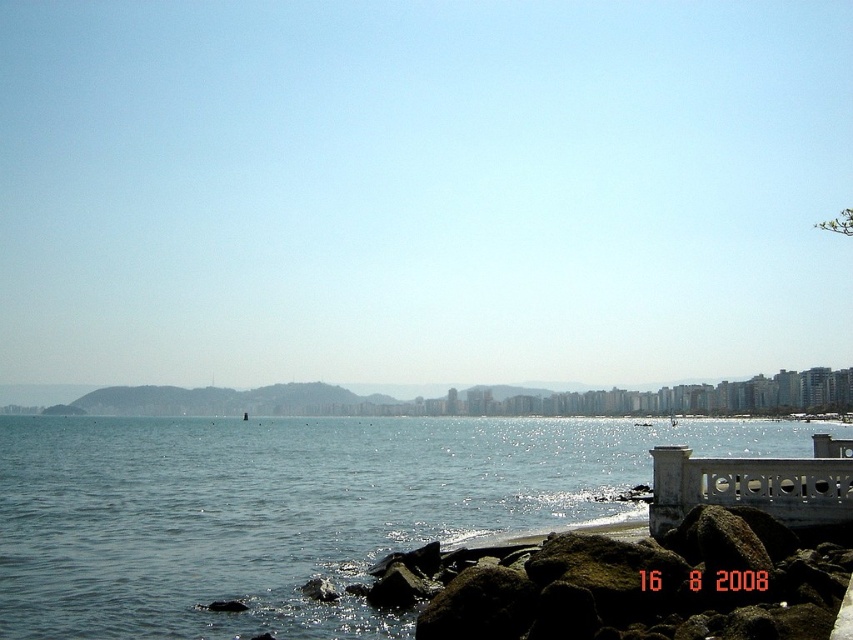
Does blue water at center appear on the right side of brown rough rocks at lower right?

In fact, blue water at center is to the left of brown rough rocks at lower right.

Does point (27, 417) come in front of point (724, 589)?

No, it is behind (724, 589).

Where is `blue water at center`? blue water at center is located at coordinates (297, 509).